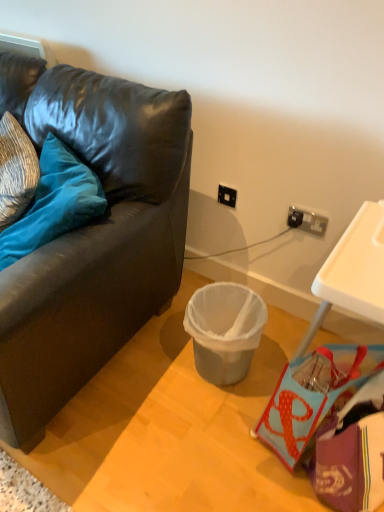
The width and height of the screenshot is (384, 512). Identify the location of blank space to the left of gray plastic trash can at center. (160, 367).